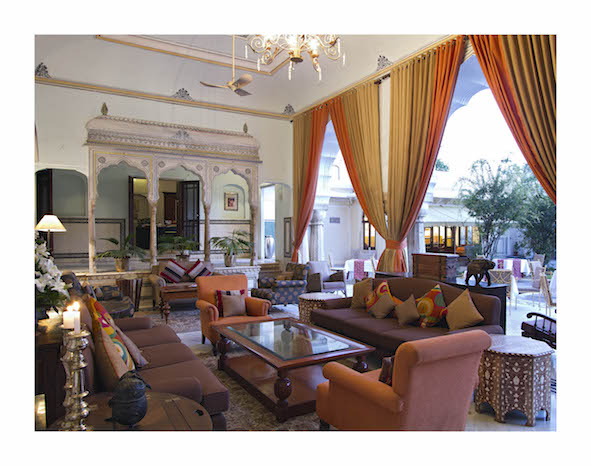
Where is `candlestick holders`? candlestick holders is located at coordinates (77, 368), (69, 358).